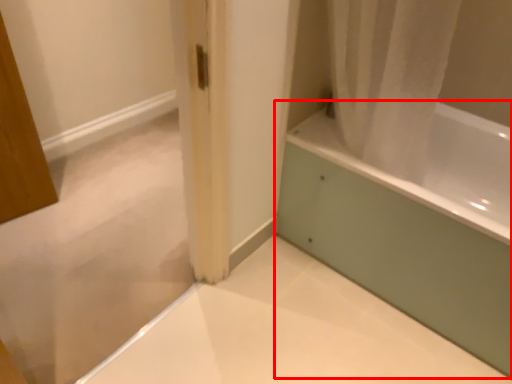
Question: Considering the relative positions of bathtub (annotated by the red box) and bath in the image provided, where is bathtub (annotated by the red box) located with respect to the staircase?

Choices:
 (A) left
 (B) right

Answer: (B)